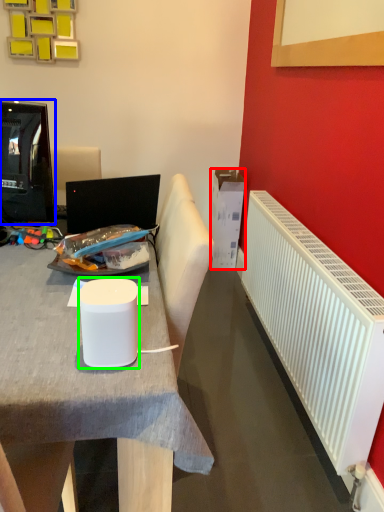
Question: Which object is positioned farthest from box (highlighted by a red box)? Select from television (highlighted by a blue box) and paper cup (highlighted by a green box).

Choices:
 (A) television
 (B) paper cup

Answer: (B)